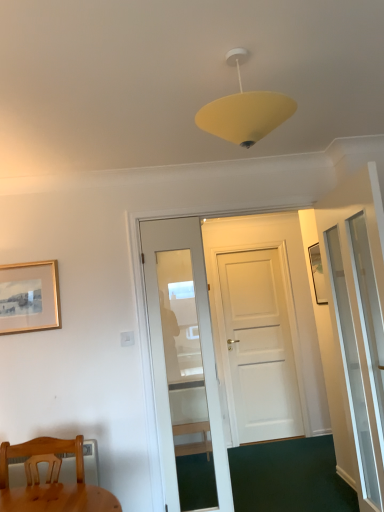
This screenshot has width=384, height=512. Describe the element at coordinates (360, 361) in the screenshot. I see `transparent glass screen door at right` at that location.

Find the location of a particular element. wooden chair at lower left is located at coordinates (41, 454).

Identify the location of transparent glass screen door at right. The width and height of the screenshot is (384, 512). (360, 361).

Is transparent glass screen door at right to the left of wooden chair at lower left from the viewer's perspective?

Incorrect, transparent glass screen door at right is not on the left side of wooden chair at lower left.

From the image's perspective, who appears lower, transparent glass screen door at right or wooden chair at lower left?

wooden chair at lower left.

Considering the points (362, 383) and (63, 444), which point is behind, point (362, 383) or point (63, 444)?

The point (362, 383) is farther from the camera.

Considering the positions of objects transparent glass screen door at right and wooden chair at lower left in the image provided, who is in front, transparent glass screen door at right or wooden chair at lower left?

wooden chair at lower left is closer to the camera.

From the image's perspective, is transparent glass screen door at right below gold metallic picture frame at upper left?

Correct, transparent glass screen door at right appears lower than gold metallic picture frame at upper left in the image.

How distant is transparent glass screen door at right from gold metallic picture frame at upper left?

transparent glass screen door at right is 6.21 feet away from gold metallic picture frame at upper left.

Which of these two, transparent glass screen door at right or gold metallic picture frame at upper left, is wider?

Wider between the two is transparent glass screen door at right.

Consider the image. What's the angular difference between transparent glass screen door at right and gold metallic picture frame at upper left's facing directions?

The facing directions of transparent glass screen door at right and gold metallic picture frame at upper left are 90.8 degrees apart.

From a real-world perspective, which object stands above the other?

transparent glass screen door at right, from a real-world perspective.

Which is in front, point (60, 462) or point (328, 240)?

The point (60, 462) is closer to the camera.

Considering the relative positions of wooden chair at lower left and transparent glass screen door at right in the image provided, is wooden chair at lower left in front of transparent glass screen door at right?

Yes, wooden chair at lower left is closer to the camera.

Is wooden chair at lower left taller or shorter than transparent glass screen door at right?

Clearly, wooden chair at lower left is shorter compared to transparent glass screen door at right.

Which of these two, gold metallic picture frame at upper left or transparent glass screen door at right, is bigger?

Bigger between the two is transparent glass screen door at right.

Locate an element on the screen. The height and width of the screenshot is (512, 384). picture frame located above the transparent glass screen door at right (from the image's perspective) is located at coordinates (29, 297).

In terms of width, does gold metallic picture frame at upper left look wider or thinner when compared to transparent glass screen door at right?

Considering their sizes, gold metallic picture frame at upper left looks slimmer than transparent glass screen door at right.

From the image's perspective, is gold metallic picture frame at upper left above transparent glass screen door at right?

Yes, from the image's perspective, gold metallic picture frame at upper left is on top of transparent glass screen door at right.

Does wooden chair at lower left have a greater width compared to gold metallic picture frame at upper left?

Correct, the width of wooden chair at lower left exceeds that of gold metallic picture frame at upper left.

Locate an element on the screen. The width and height of the screenshot is (384, 512). chair located on the right of gold metallic picture frame at upper left is located at coordinates (41, 454).

From the image's perspective, relative to gold metallic picture frame at upper left, is wooden chair at lower left above or below?

Clearly, from the image's perspective, wooden chair at lower left is below gold metallic picture frame at upper left.

Which object is positioned more to the left, wooden chair at lower left or gold metallic picture frame at upper left?

gold metallic picture frame at upper left is more to the left.

Can you confirm if gold metallic picture frame at upper left is taller than wooden chair at lower left?

Indeed, gold metallic picture frame at upper left has a greater height compared to wooden chair at lower left.

Is gold metallic picture frame at upper left directly adjacent to wooden chair at lower left?

No, gold metallic picture frame at upper left is not with wooden chair at lower left.

Locate an element on the screen. This screenshot has width=384, height=512. picture frame located behind the wooden chair at lower left is located at coordinates (29, 297).

Is gold metallic picture frame at upper left wider or thinner than wooden chair at lower left?

gold metallic picture frame at upper left is thinner than wooden chair at lower left.

This screenshot has height=512, width=384. What are the coordinates of `screen door above the wooden chair at lower left (from the image's perspective)` in the screenshot? It's located at (360, 361).

Locate an element on the screen. picture frame that is on the left side of transparent glass screen door at right is located at coordinates (29, 297).

Looking at this image, when comparing their distances from wooden chair at lower left, does transparent glass screen door at right or gold metallic picture frame at upper left seem further?

Among the two, transparent glass screen door at right is located further to wooden chair at lower left.

Based on their spatial positions, is wooden chair at lower left or transparent glass screen door at right further from gold metallic picture frame at upper left?

transparent glass screen door at right lies further to gold metallic picture frame at upper left than the other object.

When comparing their distances from wooden chair at lower left, does gold metallic picture frame at upper left or transparent glass screen door at right seem further?

transparent glass screen door at right is further to wooden chair at lower left.

Based on their spatial positions, is transparent glass screen door at right or wooden chair at lower left closer to gold metallic picture frame at upper left?

Based on the image, wooden chair at lower left appears to be nearer to gold metallic picture frame at upper left.

Estimate the real-world distances between objects in this image. Which object is closer to transparent glass screen door at right, gold metallic picture frame at upper left or wooden chair at lower left?

wooden chair at lower left lies closer to transparent glass screen door at right than the other object.

Estimate the real-world distances between objects in this image. Which object is further from transparent glass screen door at right, wooden chair at lower left or gold metallic picture frame at upper left?

gold metallic picture frame at upper left is positioned further to the anchor transparent glass screen door at right.

You are a GUI agent. You are given a task and a screenshot of the screen. Output one action in this format:
    pyautogui.click(x=<x>, y=<y>)
    Task: Click on the chair between gold metallic picture frame at upper left and transparent glass screen door at right from left to right
    
    Given the screenshot: What is the action you would take?
    [x=41, y=454]